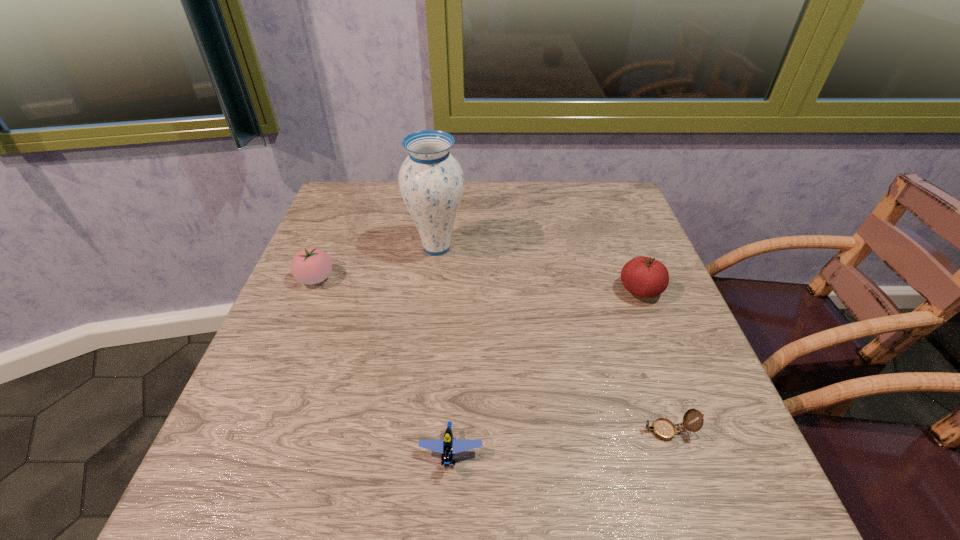
At what (x,y) coordinates should I click in order to perform the action: click on vacant space that's between the shorter tomato and the Lego. Please return your answer as a coordinate pair (x, y). Looking at the image, I should click on (383, 366).

You are a GUI agent. You are given a task and a screenshot of the screen. Output one action in this format:
    pyautogui.click(x=<x>, y=<y>)
    Task: Click on the empty location between the tallest object and the fourth tallest object
    This screenshot has width=960, height=540.
    Given the screenshot: What is the action you would take?
    pyautogui.click(x=444, y=350)

Where is `free space that is in between the tallest object and the shorter tomato`? The height and width of the screenshot is (540, 960). free space that is in between the tallest object and the shorter tomato is located at coordinates (376, 263).

This screenshot has width=960, height=540. In order to click on object identified as the fourth closest to the shorter tomato in this screenshot , I will do `click(664, 429)`.

Select which object appears as the second closest to the Lego. Please provide its 2D coordinates. Your answer should be formatted as a tuple, i.e. [(x, y)], where the tuple contains the x and y coordinates of a point satisfying the conditions above.

[(311, 265)]

You are a GUI agent. You are given a task and a screenshot of the screen. Output one action in this format:
    pyautogui.click(x=<x>, y=<y>)
    Task: Click on the free point that satisfies the following two spatial constraints: 1. on the back side of the vase; 2. on the right side of the shorter tomato
    
    Given the screenshot: What is the action you would take?
    pyautogui.click(x=328, y=247)

Locate an element on the screen. Image resolution: width=960 pixels, height=540 pixels. vacant space that satisfies the following two spatial constraints: 1. on the back side of the tallest object; 2. on the left side of the leftmost object is located at coordinates (328, 247).